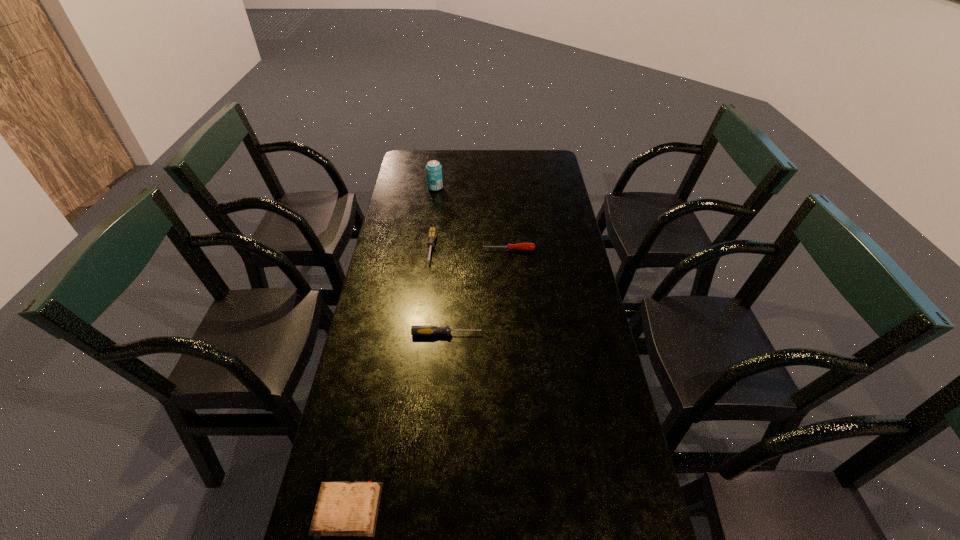
I want to click on beer can, so click(433, 168).

What are the coordinates of `the farthest object` in the screenshot? It's located at (433, 168).

Find the location of a particular element. The width and height of the screenshot is (960, 540). the second nearest object is located at coordinates [x=415, y=330].

Locate an element on the screen. This screenshot has width=960, height=540. free region located on the left of the tallest object is located at coordinates (405, 187).

This screenshot has height=540, width=960. What are the coordinates of `free spot located 0.140m insert the nearest screwdriver into a screw head` in the screenshot? It's located at (528, 334).

You are a GUI agent. You are given a task and a screenshot of the screen. Output one action in this format:
    pyautogui.click(x=<x>, y=<y>)
    Task: Click on the beer can located at the left edge
    
    Given the screenshot: What is the action you would take?
    pyautogui.click(x=433, y=168)

Find the location of a particular element. The height and width of the screenshot is (540, 960). screwdriver present at the left edge is located at coordinates point(415,330).

The width and height of the screenshot is (960, 540). Find the location of `vacant space at the far edge`. vacant space at the far edge is located at coordinates (495, 171).

The width and height of the screenshot is (960, 540). Identify the location of vacant space at the left edge of the desktop. (388, 358).

Where is `vacant space at the right edge of the desktop`? vacant space at the right edge of the desktop is located at coordinates (602, 380).